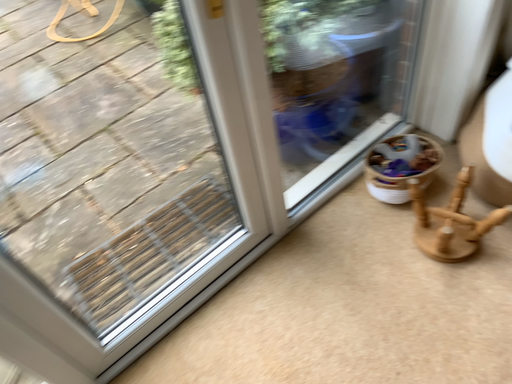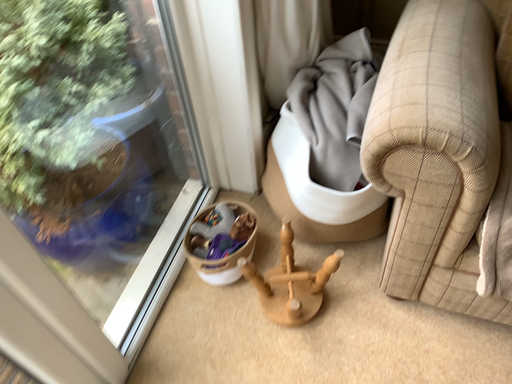
Question: How did the camera likely rotate when shooting the video?

Choices:
 (A) rotated downward
 (B) rotated upward

Answer: (B)